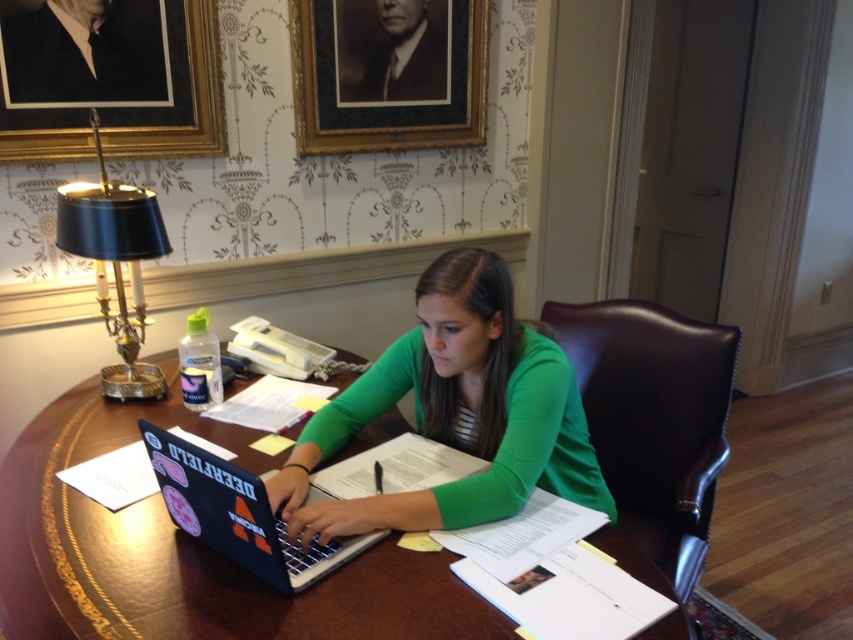
You are a delivery person who needs to place a package on the wooden table at center. The package is 3 feet wide. Can you safely place it on the table without it hanging over the edge? Please explain your reasoning.

The wooden table at center and camera are 3.38 feet apart from each other. However, the description does not provide the dimensions of the wooden table at center itself. Therefore, it is impossible to determine if the 3 feet wide package will fit without additional information about the table size.